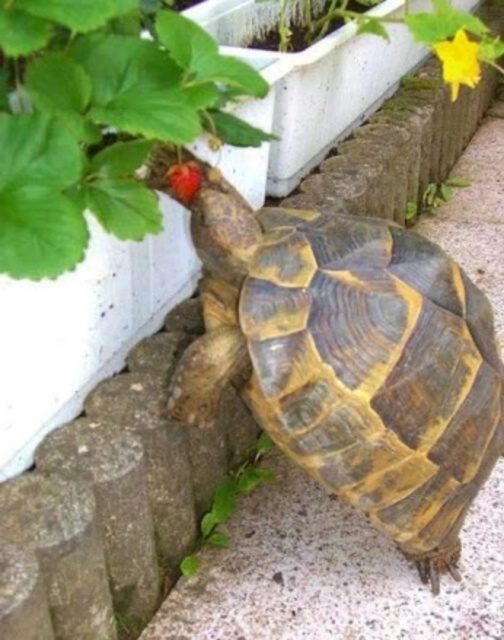
Question: Is green matte strawberry at upper left positioned before green leafy plant at upper center?

Choices:
 (A) yes
 (B) no

Answer: (A)

Question: Considering the relative positions of brown textured tortoise at center and green matte strawberry at upper left in the image provided, where is brown textured tortoise at center located with respect to green matte strawberry at upper left?

Choices:
 (A) above
 (B) below

Answer: (B)

Question: Among these points, which one is farthest from the camera?

Choices:
 (A) (412, 212)
 (B) (158, 182)

Answer: (A)

Question: Which object is closer to the camera taking this photo?

Choices:
 (A) yellow matte flower at upper right
 (B) ripe red berry at center
 (C) green matte strawberry at upper left
 (D) brown textured tortoise at center

Answer: (C)

Question: Which object is farther from the camera taking this photo?

Choices:
 (A) green matte strawberry at upper left
 (B) brown textured tortoise at center
 (C) yellow matte flower at upper right

Answer: (C)

Question: Can you confirm if brown textured tortoise at center is wider than green leafy plant at center?

Choices:
 (A) yes
 (B) no

Answer: (A)